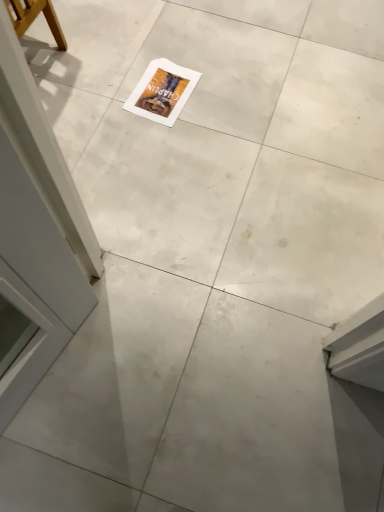
You are a GUI agent. You are given a task and a screenshot of the screen. Output one action in this format:
    pyautogui.click(x=<x>, y=<y>)
    Task: Click on the free space in front of white paper postcard at center
    The image size is (384, 512).
    Given the screenshot: What is the action you would take?
    pyautogui.click(x=151, y=136)